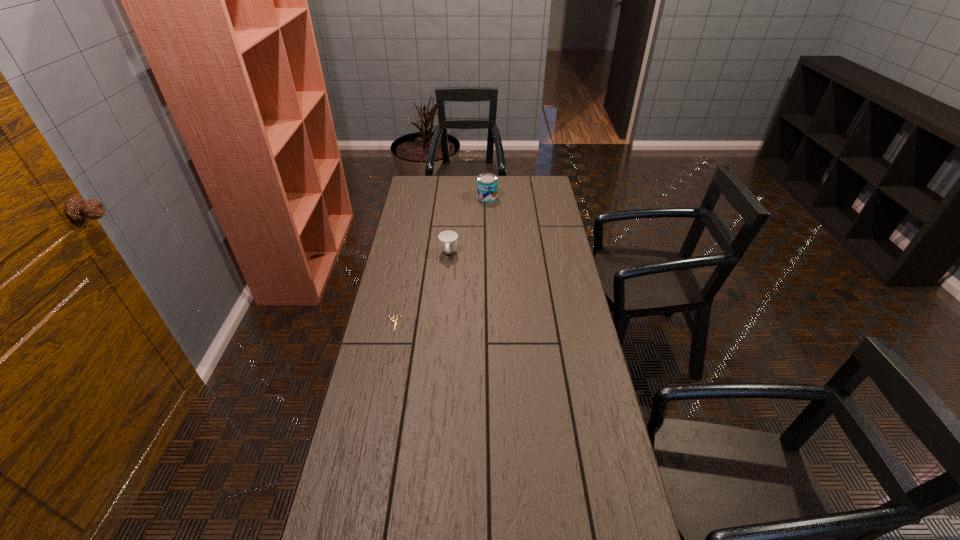
Find the location of a particular element. Image resolution: width=960 pixels, height=540 pixels. object that is at the left edge is located at coordinates (395, 322).

Identify the location of vacant area at the far edge of the desktop. (514, 184).

You are a GUI agent. You are given a task and a screenshot of the screen. Output one action in this format:
    pyautogui.click(x=<x>, y=<y>)
    Task: Click on the free location at the left edge of the desktop
    
    Given the screenshot: What is the action you would take?
    pyautogui.click(x=413, y=254)

Where is `free space at the right edge`? Image resolution: width=960 pixels, height=540 pixels. free space at the right edge is located at coordinates pos(599,522).

Locate an element on the screen. The image size is (960, 540). blank region between the second shortest object and the leftmost object is located at coordinates (421, 288).

This screenshot has width=960, height=540. In order to click on vacant space that is in between the shears and the rightmost object in this screenshot , I will do `click(441, 260)`.

You are a GUI agent. You are given a task and a screenshot of the screen. Output one action in this format:
    pyautogui.click(x=<x>, y=<y>)
    Task: Click on the unoccupied position between the shears and the rightmost object
    The width and height of the screenshot is (960, 540).
    Given the screenshot: What is the action you would take?
    pyautogui.click(x=441, y=260)

I want to click on vacant area that lies between the cup and the rightmost object, so click(468, 226).

Find the location of a particular element. The width and height of the screenshot is (960, 540). free spot between the second object from right to left and the shortest object is located at coordinates (421, 288).

You are a GUI agent. You are given a task and a screenshot of the screen. Output one action in this format:
    pyautogui.click(x=<x>, y=<y>)
    Task: Click on the free space between the nearest object and the cup
    
    Given the screenshot: What is the action you would take?
    click(421, 288)